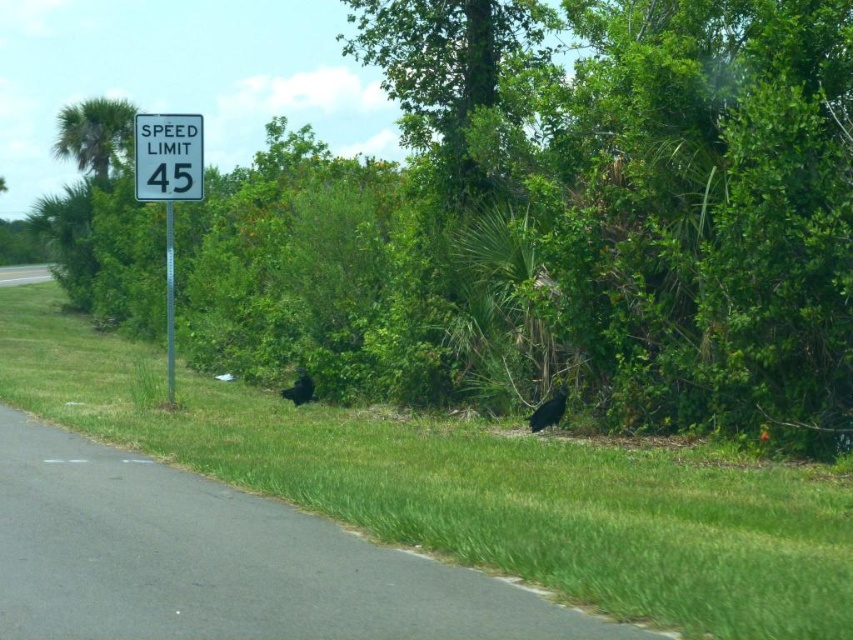
You are a driver approaching a road with a white plastic speed limit sign at upper center and a green leafy tree at upper left. Based on their widths, which object would appear smaller in your view?

The white plastic speed limit sign at upper center has a lesser width compared to the green leafy tree at upper left, so it would appear smaller in your view.

You are a driver approaching the intersection and see the white plastic speed limit sign at upper center and the green leafy tree at upper left. Which object is positioned more to the right side of the image?

The white plastic speed limit sign at upper center is positioned more to the right side of the image compared to the green leafy tree at upper left.

You are a GPS navigation system trying to determine the location of the white plastic speed limit sign at upper left in the image. What are its coordinates?

The white plastic speed limit sign at upper left is located at coordinates point (167, 188).